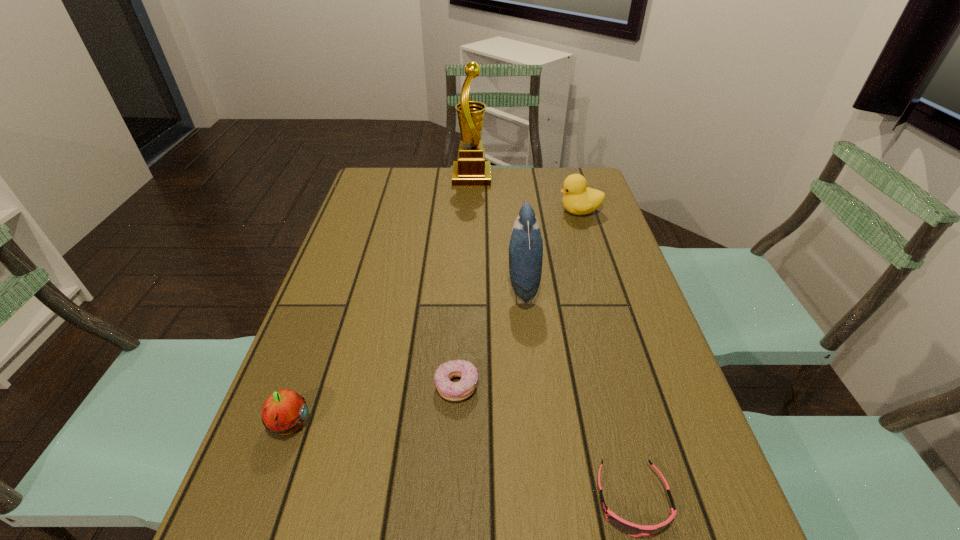
At what (x,y) coordinates should I click in order to perform the action: click on the tallest object. Please return your answer as a coordinate pair (x, y). This screenshot has width=960, height=540. Looking at the image, I should click on (471, 170).

Locate an element on the screen. Image resolution: width=960 pixels, height=540 pixels. the farthest object is located at coordinates (x=471, y=170).

Where is `the fourth object from left to right`? The height and width of the screenshot is (540, 960). the fourth object from left to right is located at coordinates (526, 244).

The image size is (960, 540). What are the coordinates of `the second tallest object` in the screenshot? It's located at (526, 244).

Locate an element on the screen. The image size is (960, 540). the fifth nearest object is located at coordinates (579, 199).

This screenshot has height=540, width=960. What are the coordinates of `the third tallest object` in the screenshot? It's located at (579, 199).

Locate an element on the screen. The image size is (960, 540). the third shortest object is located at coordinates (284, 411).

Locate an element on the screen. the leftmost object is located at coordinates (284, 411).

The image size is (960, 540). I want to click on doughnut, so click(453, 391).

The width and height of the screenshot is (960, 540). In order to click on vacant position located 0.210m on the front-facing side of the award in this screenshot , I will do `click(551, 178)`.